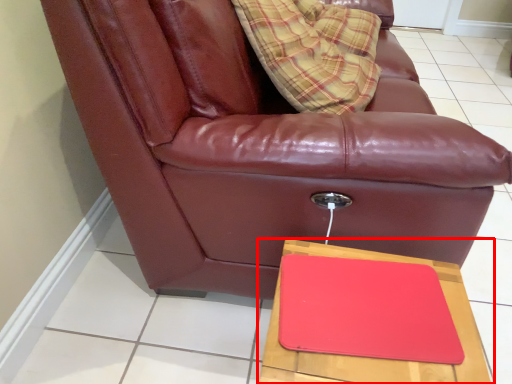
Question: From the image's perspective, what is the correct spatial relationship of table (annotated by the red box) in relation to chair?

Choices:
 (A) above
 (B) below

Answer: (B)